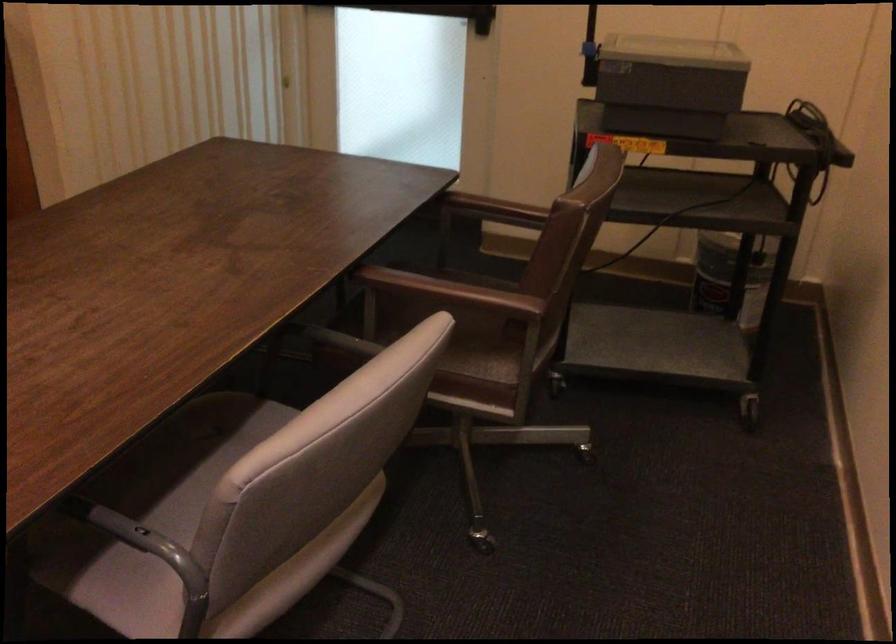
The width and height of the screenshot is (896, 644). What do you see at coordinates (668, 84) in the screenshot? I see `the grey printer` at bounding box center [668, 84].